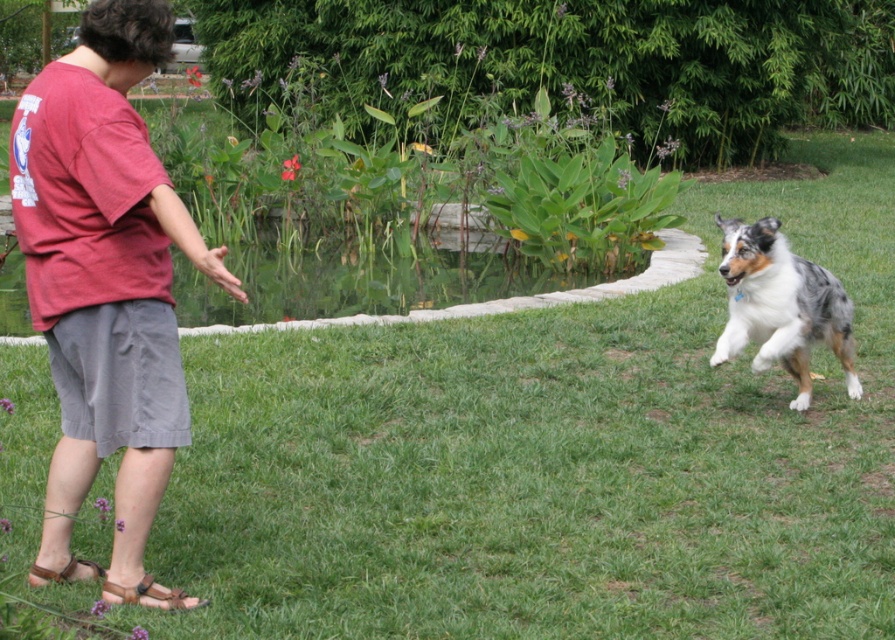
You are a photographer trying to capture a photo of the two points in the image. Which point, point (131, 445) or point (743, 333), will appear larger in your photo?

Point (131, 445) is closer to the camera than point (743, 333), so it will appear larger in the photo.